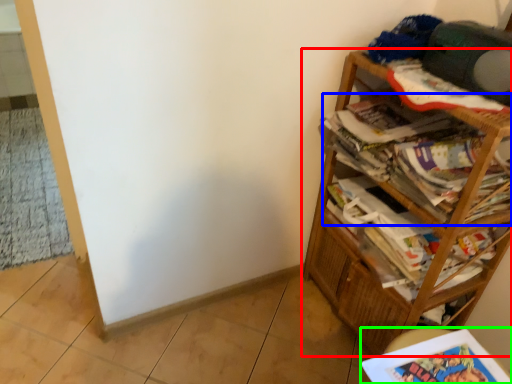
Question: Which object is the farthest from bookcase (highlighted by a red box)? Choose among these: magazine (highlighted by a blue box) or book (highlighted by a green box).

Choices:
 (A) magazine
 (B) book

Answer: (B)